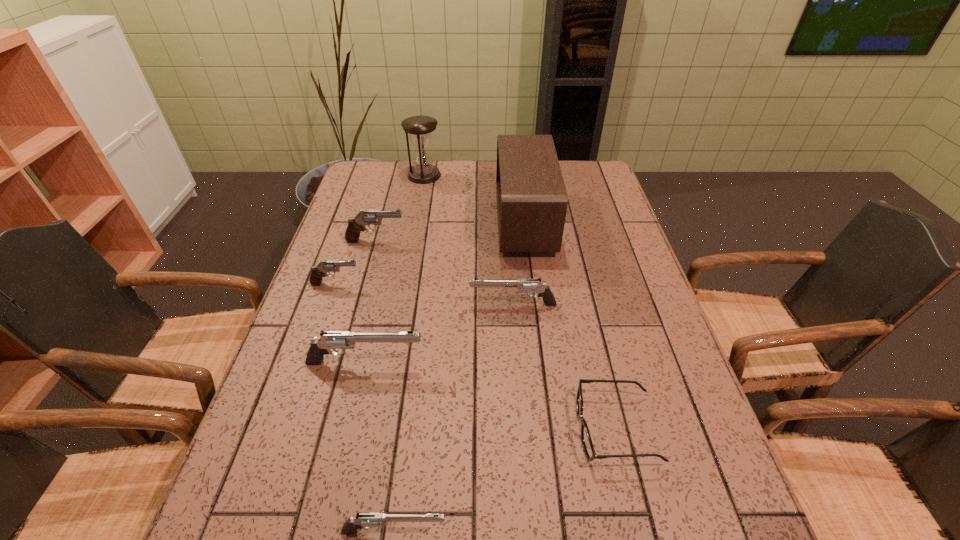
This screenshot has width=960, height=540. I want to click on vacant space situated 0.260m on the front-facing side of the fifth farthest object, so click(x=370, y=305).

Where is `vacant position located on the front-facing side of the fifth farthest object`? The height and width of the screenshot is (540, 960). vacant position located on the front-facing side of the fifth farthest object is located at coordinates (404, 305).

Where is `vacant space located 0.060m on the front-facing side of the fifth farthest object`? Image resolution: width=960 pixels, height=540 pixels. vacant space located 0.060m on the front-facing side of the fifth farthest object is located at coordinates (446, 305).

In order to click on vacant space situated at the barrel of the nearer gray pistol in this screenshot , I will do `click(496, 284)`.

Image resolution: width=960 pixels, height=540 pixels. What are the coordinates of `free space located on the front-facing side of the shortest pistol` in the screenshot? It's located at (517, 531).

The image size is (960, 540). In order to click on blank space located 0.110m on the front-facing side of the seventh farthest object in this screenshot , I will do `click(522, 429)`.

This screenshot has height=540, width=960. I want to click on vacant space positioned 0.150m on the front-facing side of the seventh farthest object, so click(502, 429).

Where is `vacant space located on the front-facing side of the seventh farthest object`? The image size is (960, 540). vacant space located on the front-facing side of the seventh farthest object is located at coordinates (473, 429).

The image size is (960, 540). Identify the location of radio receiver present at the far edge. (532, 200).

Image resolution: width=960 pixels, height=540 pixels. I want to click on hourglass at the far edge, so tap(419, 128).